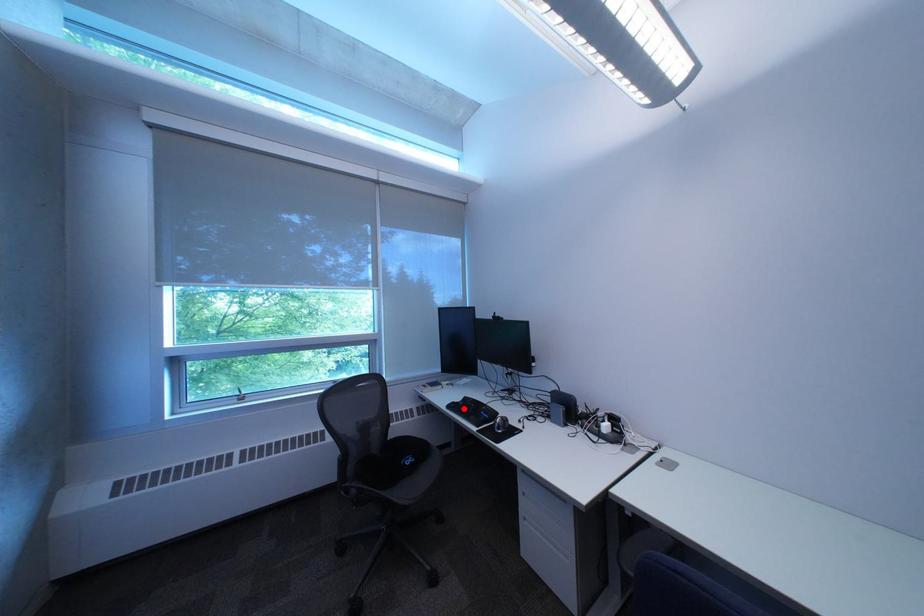
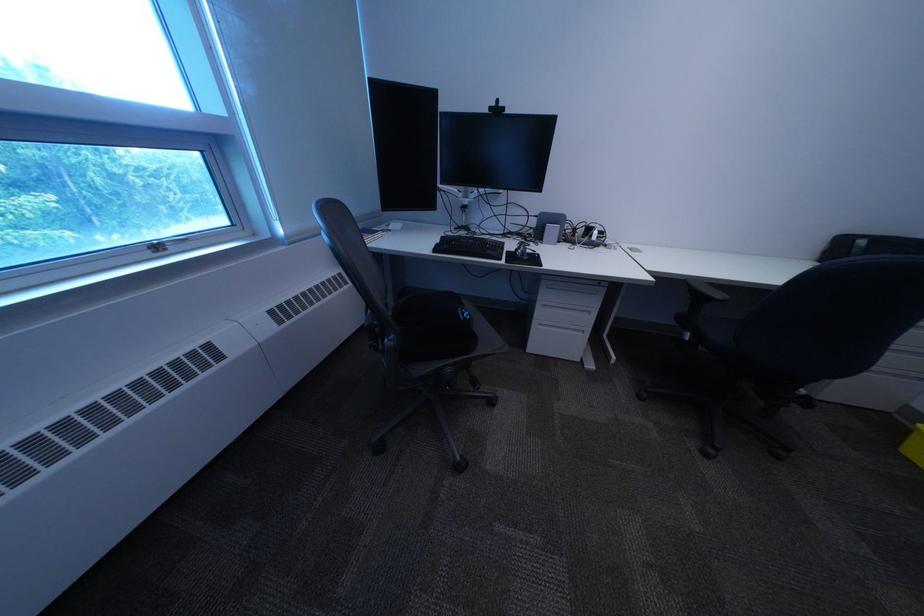
Locate, in the second image, the point that corresponds to the highlighted location in the first image.

(451, 252)